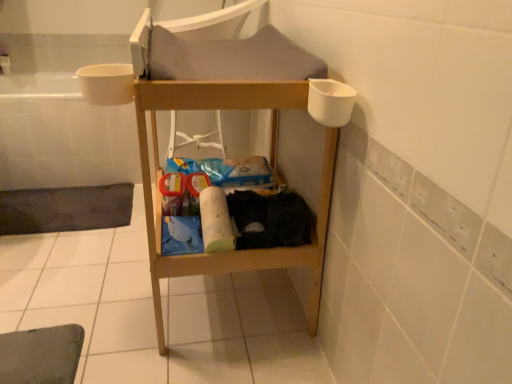
Identify the location of vacant area situated below dark gray mesh bath mat at lower left (from a real-world perspective). Image resolution: width=512 pixels, height=384 pixels. (58, 206).